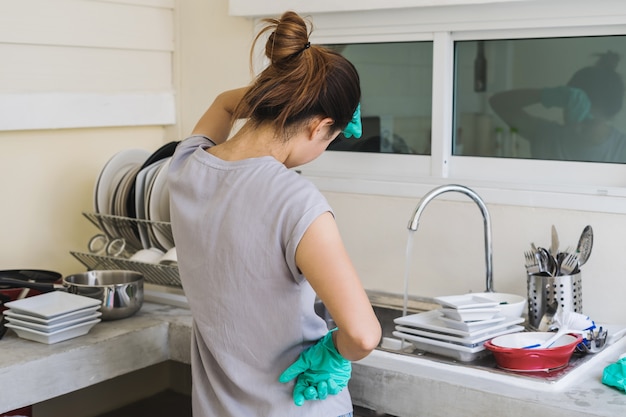
Locate an element on the screen. The height and width of the screenshot is (417, 626). faucet neck is located at coordinates (459, 188).